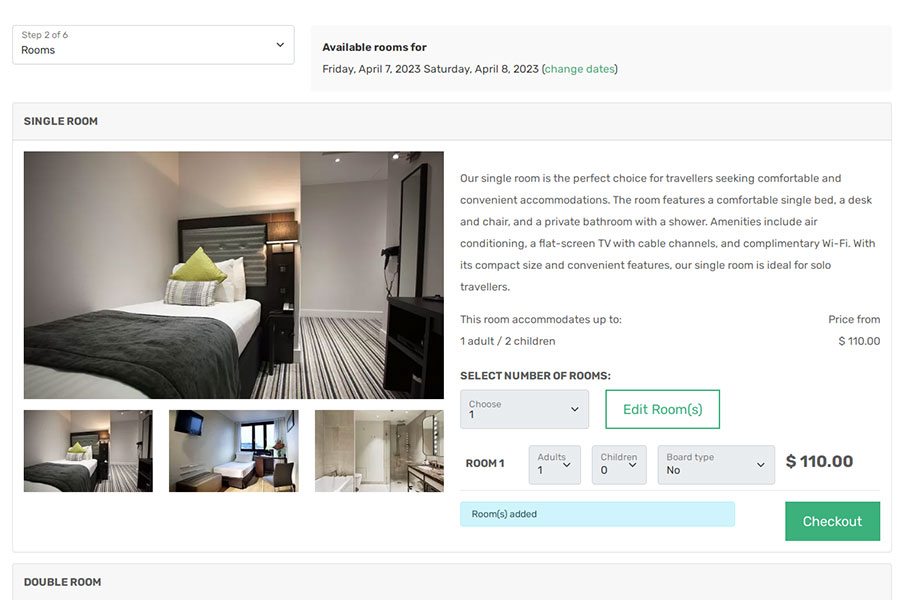
Find the location of a particular element. The width and height of the screenshot is (900, 600). description of room is located at coordinates (592, 213).